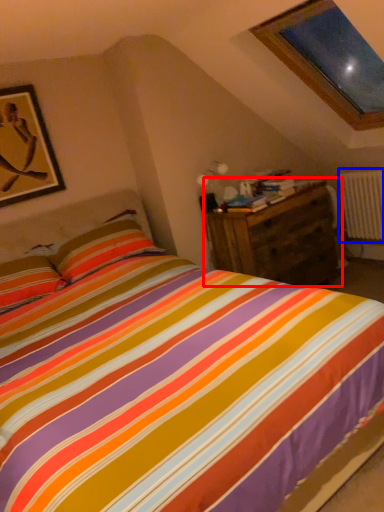
Question: Which object is closer to the camera taking this photo, nightstand (highlighted by a red box) or radiator (highlighted by a blue box)?

Choices:
 (A) nightstand
 (B) radiator

Answer: (A)